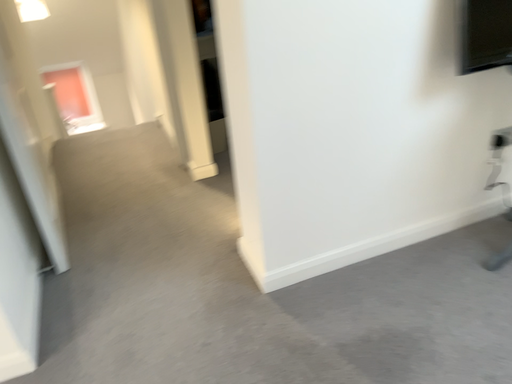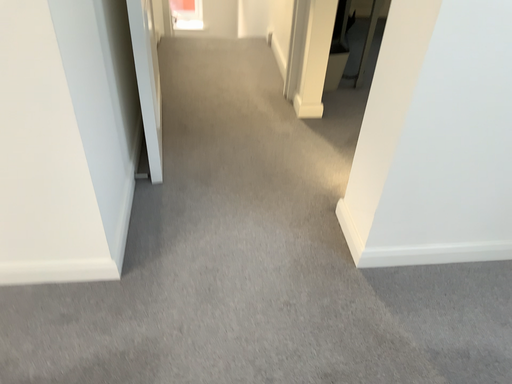
Question: Which way did the camera rotate in the video?

Choices:
 (A) rotated downward
 (B) rotated upward

Answer: (A)